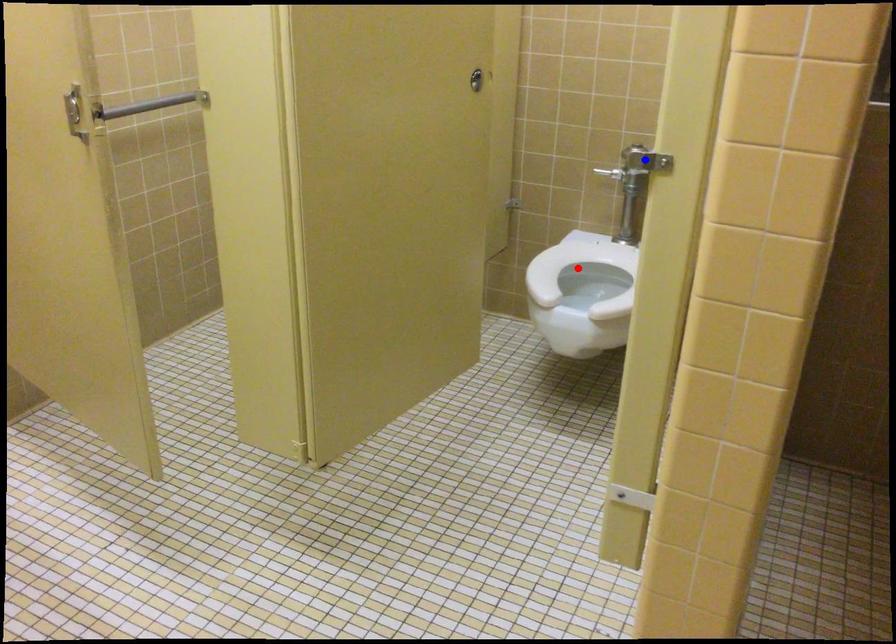
Question: Which of the two points in the image is closer to the camera?

Choices:
 (A) Blue point is closer.
 (B) Red point is closer.

Answer: (A)